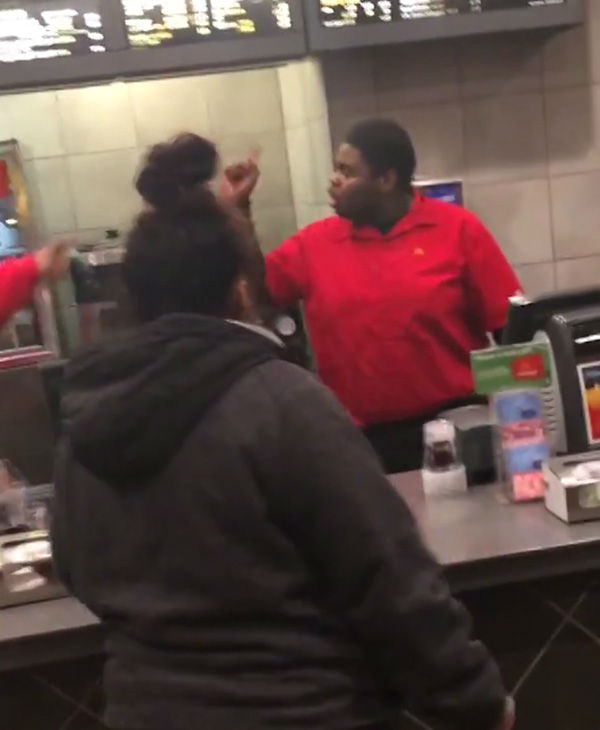
Find the location of a particular element. The image size is (600, 730). grey countertop is located at coordinates (477, 547).